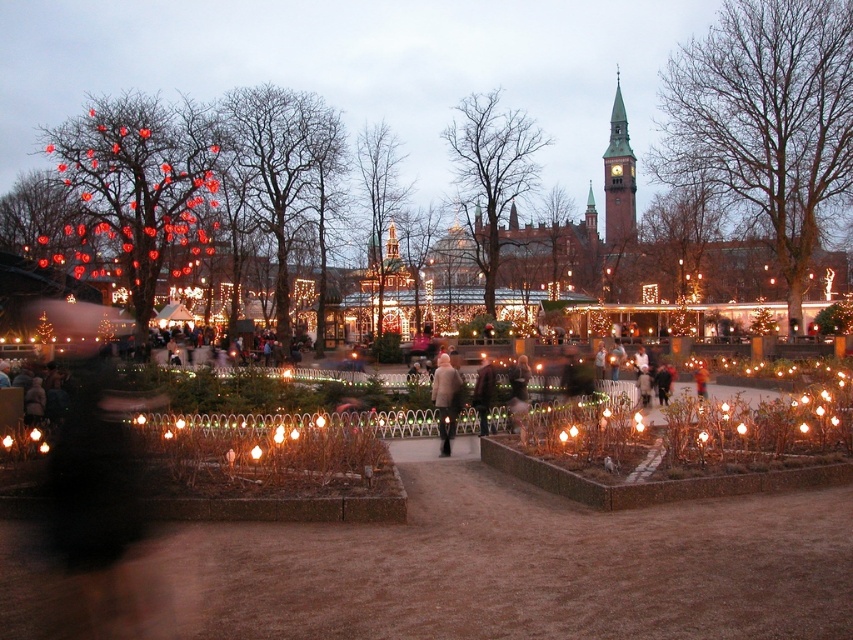
This screenshot has width=853, height=640. Find the location of `smooth bark tree at center`. smooth bark tree at center is located at coordinates (680, 236).

Is smooth bark tree at center to the right of light brown leather jacket at center from the viewer's perspective?

Indeed, smooth bark tree at center is positioned on the right side of light brown leather jacket at center.

Describe the element at coordinates (680, 236) in the screenshot. This screenshot has height=640, width=853. I see `smooth bark tree at center` at that location.

Locate an element on the screen. The height and width of the screenshot is (640, 853). smooth bark tree at center is located at coordinates (680, 236).

Can you confirm if smooth brown tree at center is positioned to the right of bare branches at center?

In fact, smooth brown tree at center is to the left of bare branches at center.

Is smooth brown tree at center below bare branches at center?

Correct, smooth brown tree at center is located below bare branches at center.

The image size is (853, 640). In order to click on smooth brown tree at center in this screenshot , I will do `click(283, 170)`.

The height and width of the screenshot is (640, 853). I want to click on smooth brown tree at center, so click(283, 170).

Is smooth brown tree at center bigger than green copper clock tower at upper center?

No.

Which of these two, smooth brown tree at center or green copper clock tower at upper center, stands shorter?

Standing shorter between the two is smooth brown tree at center.

Is point (323, 260) in front of point (612, 218)?

Yes.

The width and height of the screenshot is (853, 640). Identify the location of smooth brown tree at center. (283, 170).